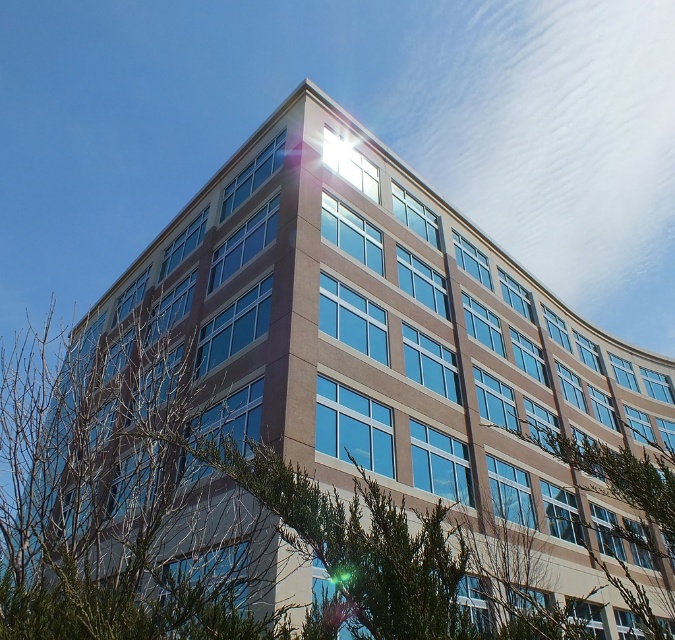
Question: Is green leafy tree at center below green leafy tree at lower right?

Choices:
 (A) yes
 (B) no

Answer: (B)

Question: Which point is closer to the camera?

Choices:
 (A) (162, 509)
 (B) (630, 541)

Answer: (A)

Question: Is green leafy tree at center to the left of green leafy tree at lower right from the viewer's perspective?

Choices:
 (A) yes
 (B) no

Answer: (A)

Question: Is green leafy tree at center wider than green leafy tree at lower right?

Choices:
 (A) yes
 (B) no

Answer: (A)

Question: Which point is farther to the camera?

Choices:
 (A) green leafy tree at center
 (B) green leafy tree at lower right

Answer: (A)